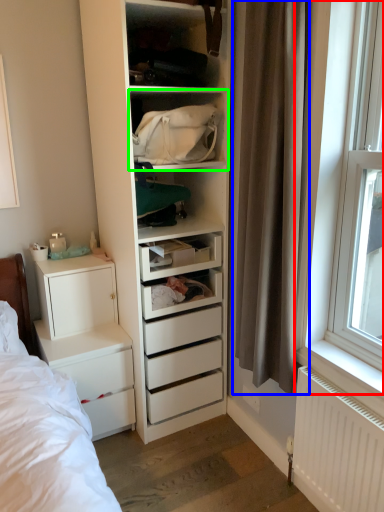
Question: Estimate the real-world distances between objects in this image. Which object is farther from window (highlighted by a red box), curtain (highlighted by a blue box) or shelf (highlighted by a green box)?

Choices:
 (A) curtain
 (B) shelf

Answer: (B)